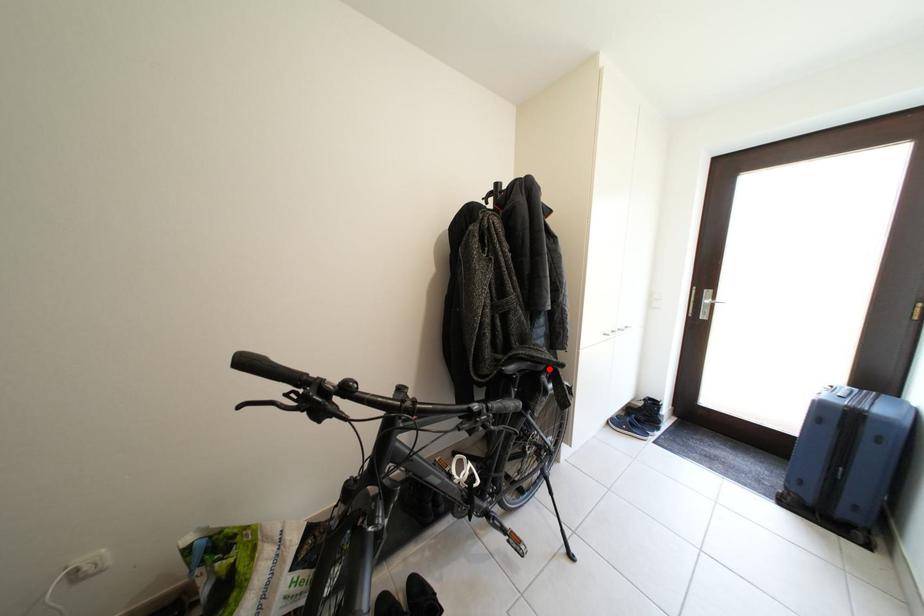
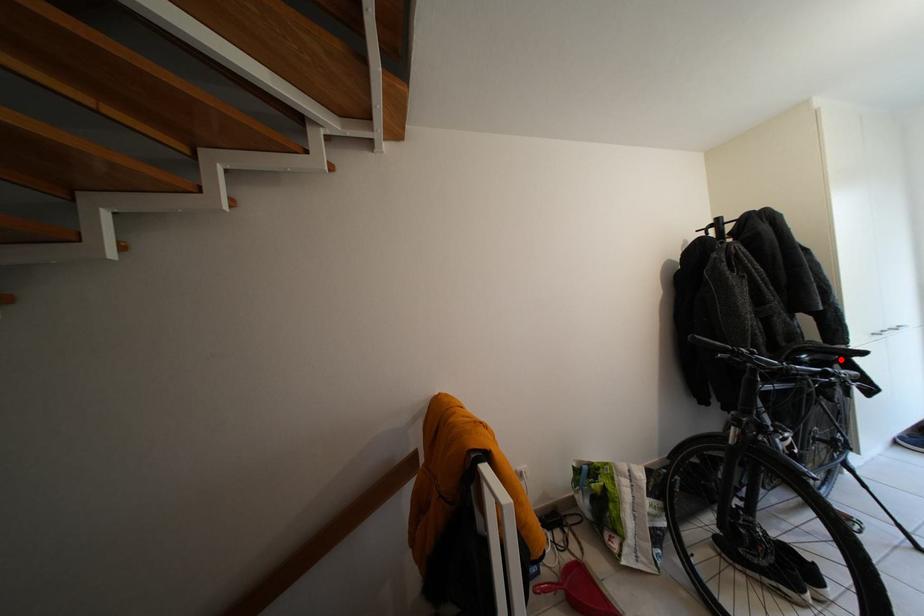
I am providing you with two images of the same scene from different viewpoints. A red point is marked on the first image and another point is marked on the second image. Is the red point in image1 aligned with the point shown in image2?

Yes